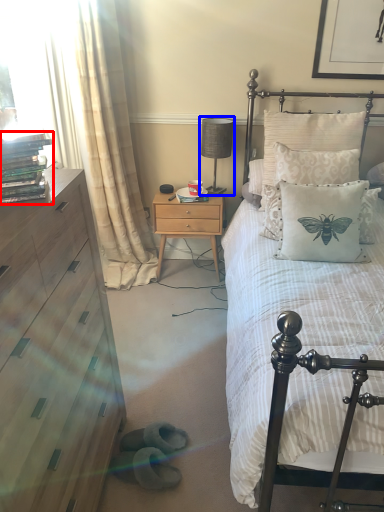
Question: Among these objects, which one is farthest to the camera, book (highlighted by a red box) or table lamp (highlighted by a blue box)?

Choices:
 (A) book
 (B) table lamp

Answer: (B)